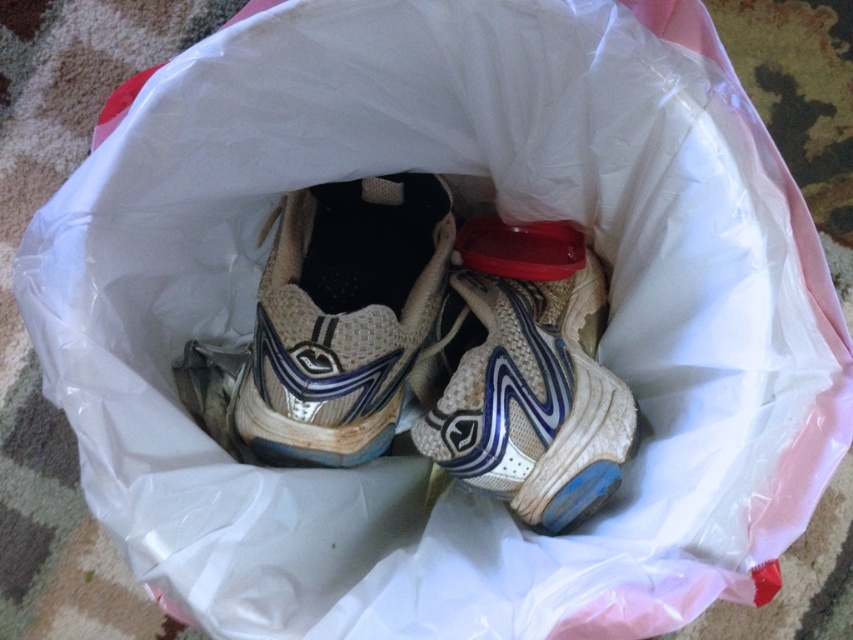
Is point (376, 307) farther from viewer compared to point (471, 275)?

No, (376, 307) is in front of (471, 275).

Does worn beige fabric shoe at center have a larger size compared to white mesh shoe at center?

Incorrect, worn beige fabric shoe at center is not larger than white mesh shoe at center.

Between point (318, 387) and point (498, 355), which one is positioned behind?

Positioned behind is point (498, 355).

This screenshot has width=853, height=640. In order to click on worn beige fabric shoe at center in this screenshot , I will do `click(343, 317)`.